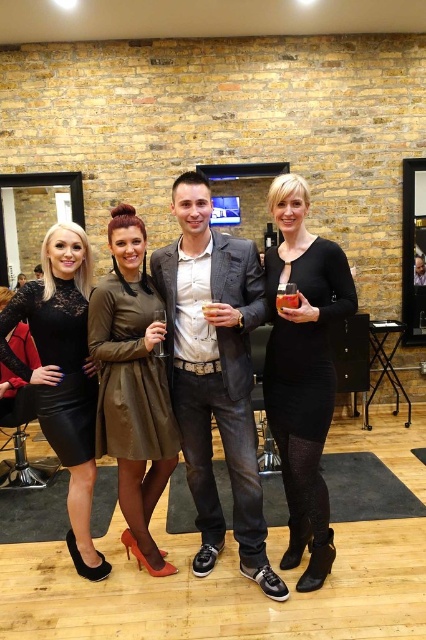
Between matte gray blazer at center and black leather dress at lower left, which one is positioned higher?

Positioned higher is matte gray blazer at center.

Can you confirm if matte gray blazer at center is positioned to the right of black leather dress at lower left?

Indeed, matte gray blazer at center is positioned on the right side of black leather dress at lower left.

Does point (255, 426) lie in front of point (46, 285)?

That is False.

This screenshot has width=426, height=640. I want to click on matte gray blazer at center, so click(215, 374).

Is black leather dress at lower left wider than translucent plastic cup at center?

Yes, black leather dress at lower left is wider than translucent plastic cup at center.

Looking at this image, is black leather dress at lower left bigger than translucent plastic cup at center?

Yes.

What do you see at coordinates (63, 374) in the screenshot? Image resolution: width=426 pixels, height=640 pixels. I see `black leather dress at lower left` at bounding box center [63, 374].

Identify the location of black leather dress at lower left. (63, 374).

Is leather dress at center in front of translucent plastic cup at center?

No.

Does leather dress at center lie behind translucent plastic cup at center?

Yes, it is.

Is point (152, 349) behind point (291, 298)?

Yes, point (152, 349) is farther from viewer.

Identify the location of leather dress at center. The height and width of the screenshot is (640, 426). (132, 385).